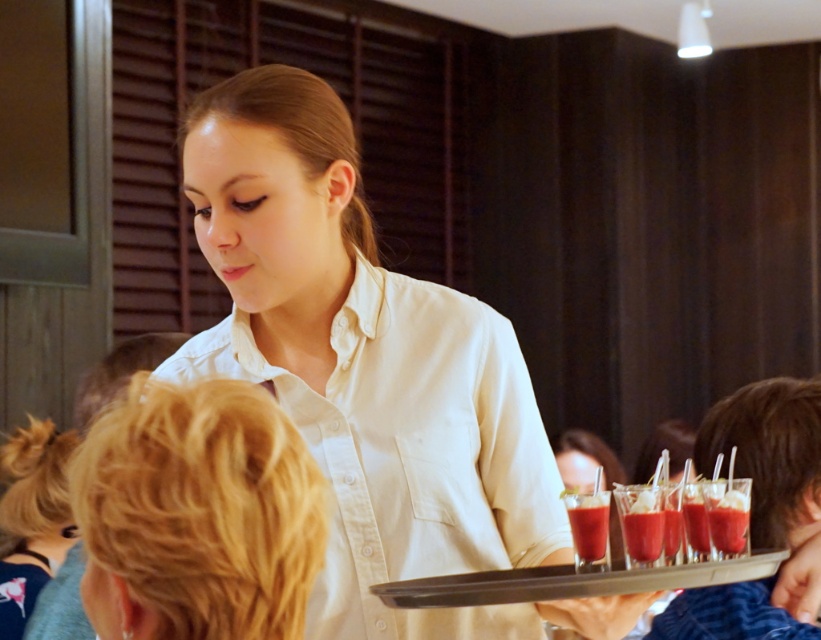
Is translucent glass cups at lower right smaller than translucent glass drink at center?

Actually, translucent glass cups at lower right might be larger than translucent glass drink at center.

Which is more to the right, translucent glass cups at lower right or translucent glass drink at center?

translucent glass cups at lower right

Is point (797, 404) less distant than point (656, 528)?

No.

Identify the location of translucent glass cups at lower right. Image resolution: width=821 pixels, height=640 pixels. (762, 515).

Which of these two, white cotton shirt at center or translucent glass beverage at center, stands shorter?

Standing shorter between the two is translucent glass beverage at center.

Describe the element at coordinates (370, 372) in the screenshot. I see `white cotton shirt at center` at that location.

Find the location of a particular element. white cotton shirt at center is located at coordinates (370, 372).

Is white cotton shirt at center shorter than translucent glass cups at lower right?

Incorrect, white cotton shirt at center's height does not fall short of translucent glass cups at lower right's.

Does point (378, 620) come behind point (762, 422)?

No, it is in front of (762, 422).

The width and height of the screenshot is (821, 640). I want to click on white cotton shirt at center, so click(x=370, y=372).